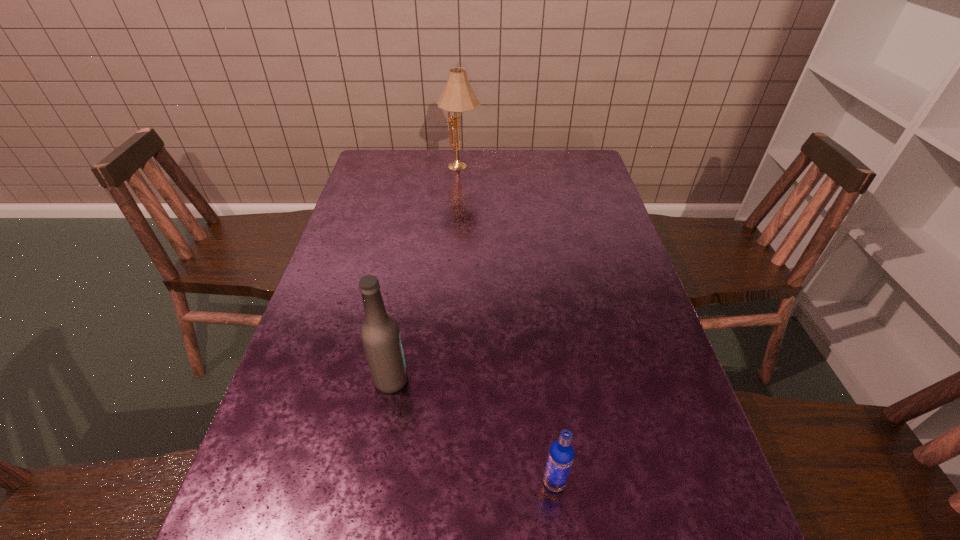
This screenshot has height=540, width=960. Find the location of `free space between the shortest object and the leftmost object`. free space between the shortest object and the leftmost object is located at coordinates (472, 431).

Where is `empty space that is in between the shortest object and the tallest object`? empty space that is in between the shortest object and the tallest object is located at coordinates (508, 325).

Locate an element on the screen. The height and width of the screenshot is (540, 960). blank region between the leftmost object and the shortest object is located at coordinates (472, 431).

Find the location of a particular element. The image size is (960, 540). empty location between the nearest object and the tallest object is located at coordinates (508, 325).

Find the location of a particular element. free spot between the nearest object and the lampshade is located at coordinates (508, 325).

Identify which object is located as the nearest to the second farthest object. Please provide its 2D coordinates. Your answer should be formatted as a tuple, i.e. [(x, y)], where the tuple contains the x and y coordinates of a point satisfying the conditions above.

[(561, 454)]

Identify the location of object that is the second closest to the farthest object. The height and width of the screenshot is (540, 960). (561, 454).

Find the location of a particular element. This screenshot has width=960, height=540. vacant region that satisfies the following two spatial constraints: 1. on the front side of the tallest object; 2. on the label of the second nearest object is located at coordinates (447, 380).

Identify the location of free space that satisfies the following two spatial constraints: 1. on the front side of the second object from right to left; 2. on the label of the second nearest object. The width and height of the screenshot is (960, 540). (447, 380).

I want to click on free spot that satisfies the following two spatial constraints: 1. on the label of the vodka; 2. on the right side of the beer bottle, so click(373, 482).